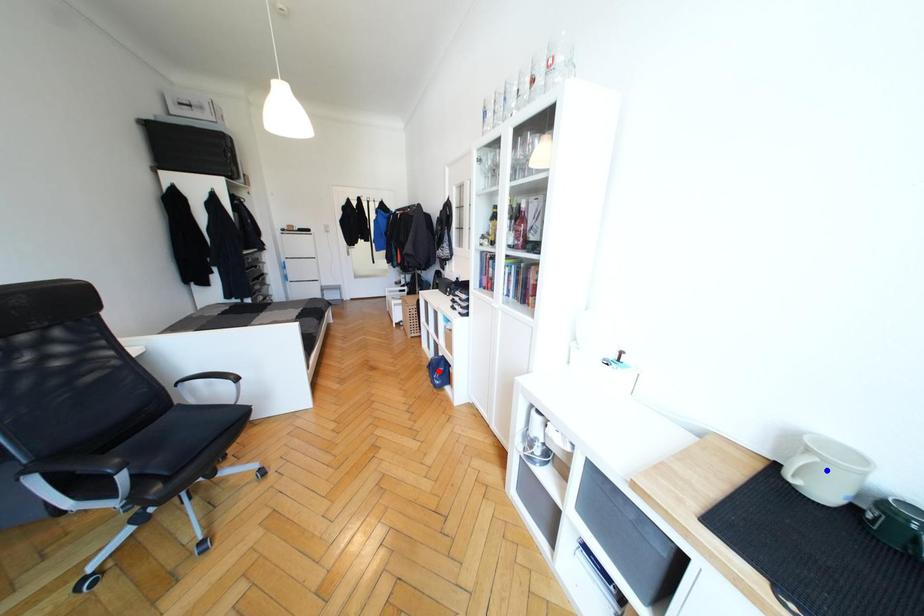
Question: In the image, two points are highlighted. Which point is nearer to the camera? Reply with the corresponding letter.

Choices:
 (A) blue point
 (B) red point

Answer: (A)